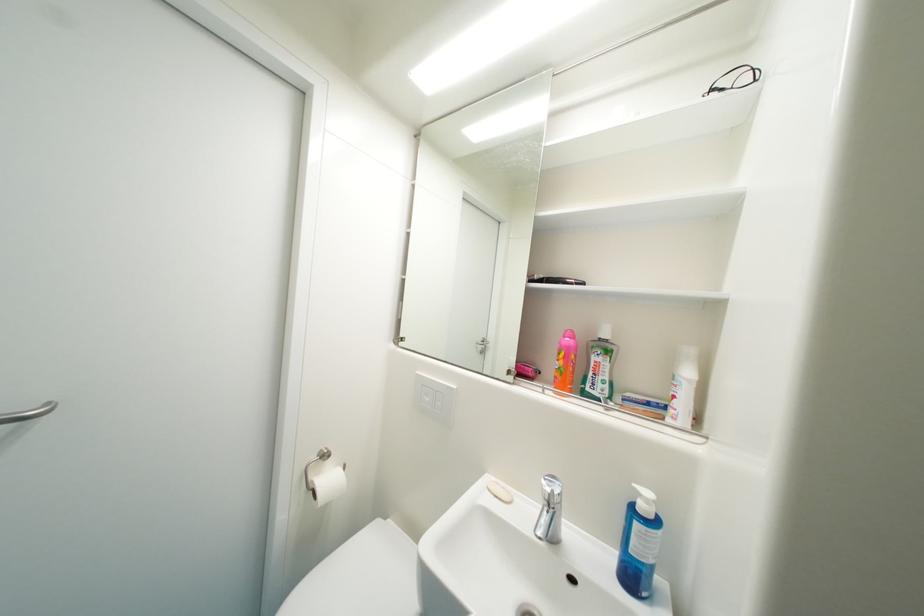
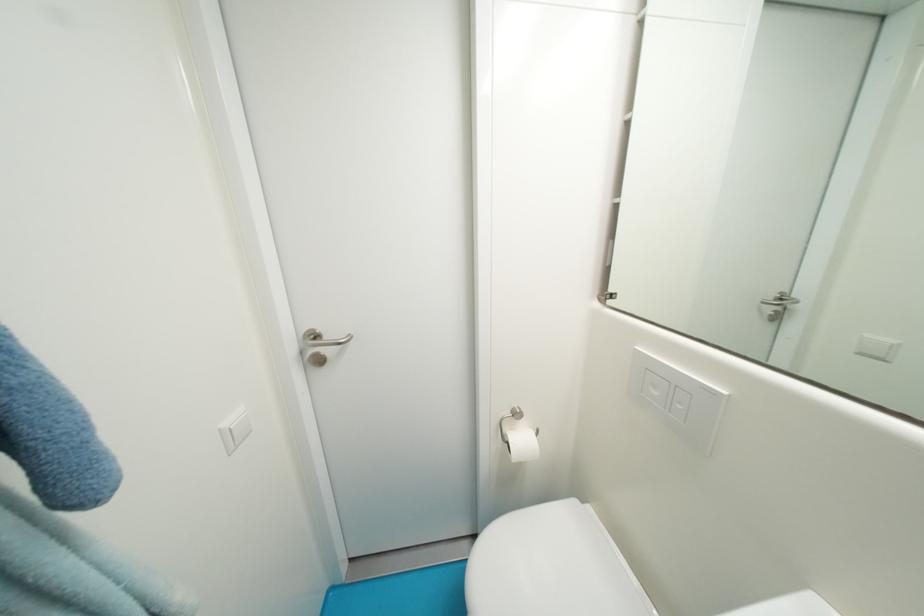
The point at (487, 350) is marked in the first image. Where is the corresponding point in the second image?

(777, 312)